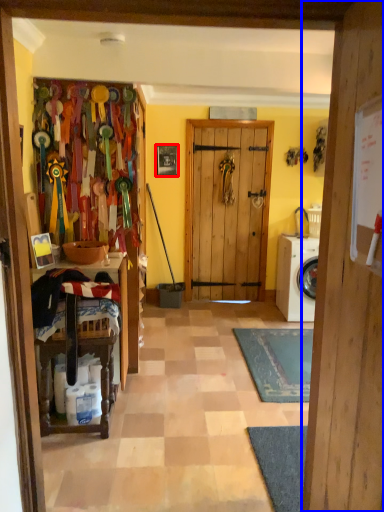
Question: Which object is closer to the camera taking this photo, picture frame (highlighted by a red box) or door (highlighted by a blue box)?

Choices:
 (A) picture frame
 (B) door

Answer: (B)